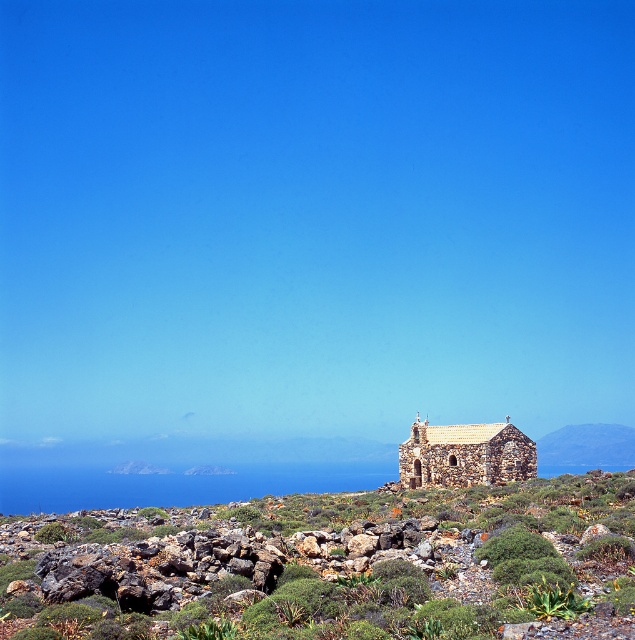
Question: Which of the following is the closest to the observer?

Choices:
 (A) green mossy rocks at center
 (B) stone textured church at center

Answer: (A)

Question: Is green mossy rocks at center closer to camera compared to stone textured church at center?

Choices:
 (A) no
 (B) yes

Answer: (B)

Question: Can you confirm if green mossy rocks at center is positioned below stone textured church at center?

Choices:
 (A) yes
 (B) no

Answer: (A)

Question: Among these objects, which one is farthest from the camera?

Choices:
 (A) green mossy rocks at center
 (B) stone textured church at center

Answer: (B)

Question: Which object is closer to the camera taking this photo?

Choices:
 (A) stone textured church at center
 (B) green mossy rocks at center

Answer: (B)

Question: Is green mossy rocks at center smaller than stone textured church at center?

Choices:
 (A) no
 (B) yes

Answer: (A)